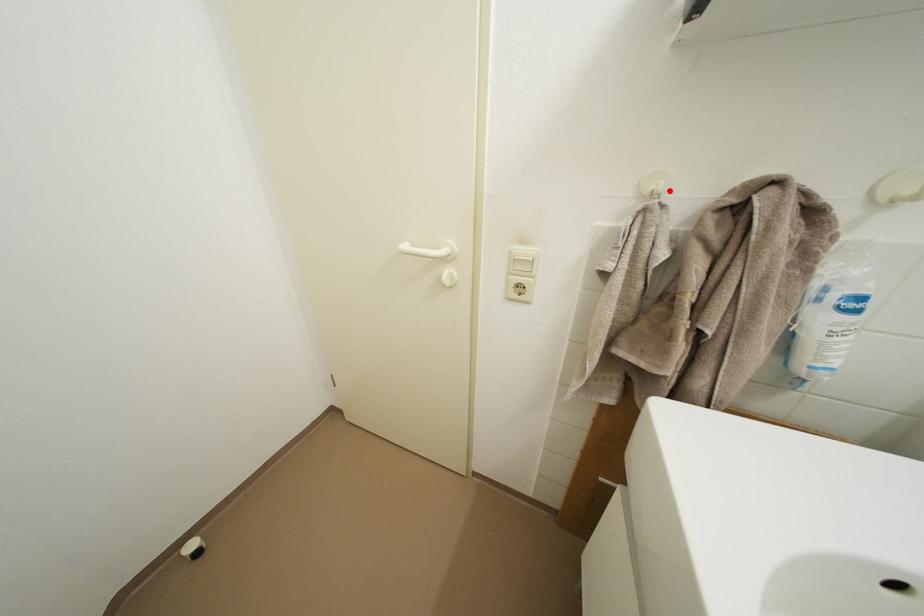
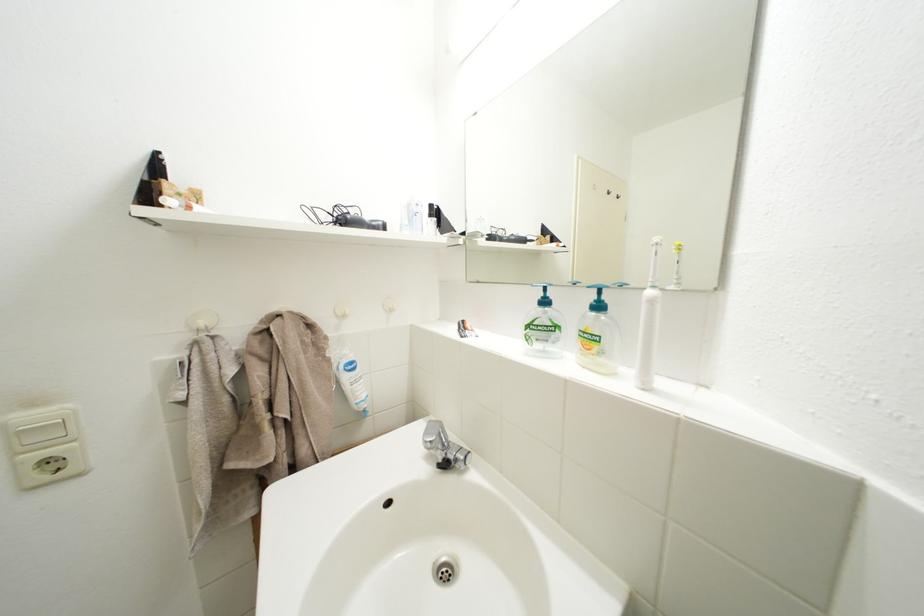
Find the pixel in the second image that matches the highlighted location in the first image.

(211, 329)